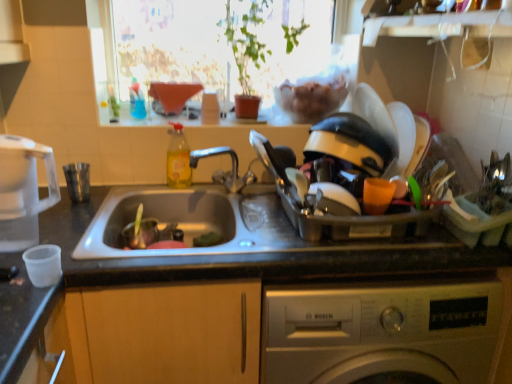
You are a GUI agent. You are given a task and a screenshot of the screen. Output one action in this format:
    pyautogui.click(x=<x>, y=<y>)
    Task: Click on the vacant area that is situated to the right of translucent yellow liquid at sink left
    The image size is (512, 384).
    Given the screenshot: What is the action you would take?
    pyautogui.click(x=231, y=191)